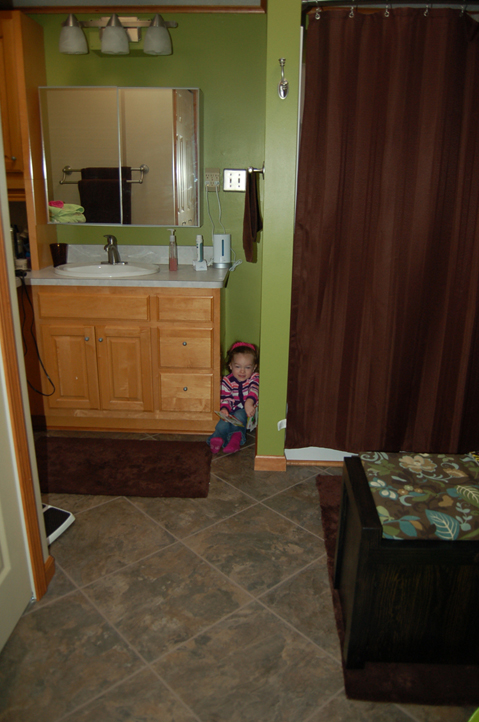
Locate an element on the screen. This screenshot has width=479, height=722. sink is located at coordinates (110, 264).